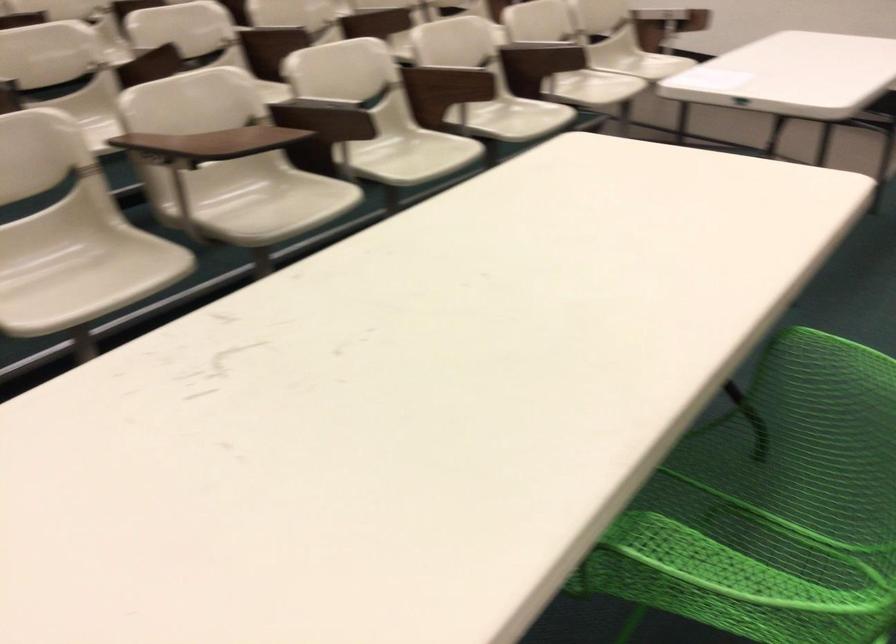
Find where to resting arm the green chair armrest. Please return your answer as a coordinate pair (x, y).

(839, 330)